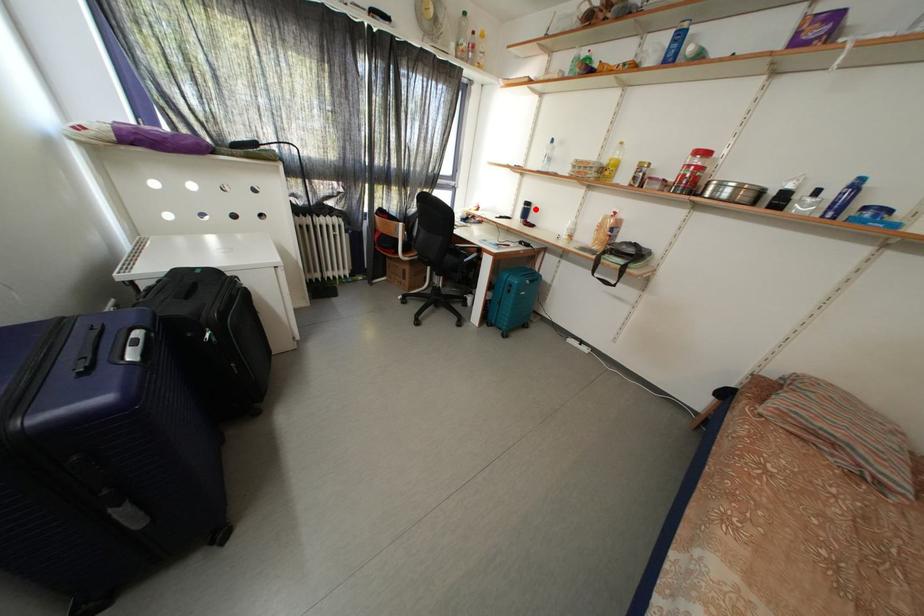
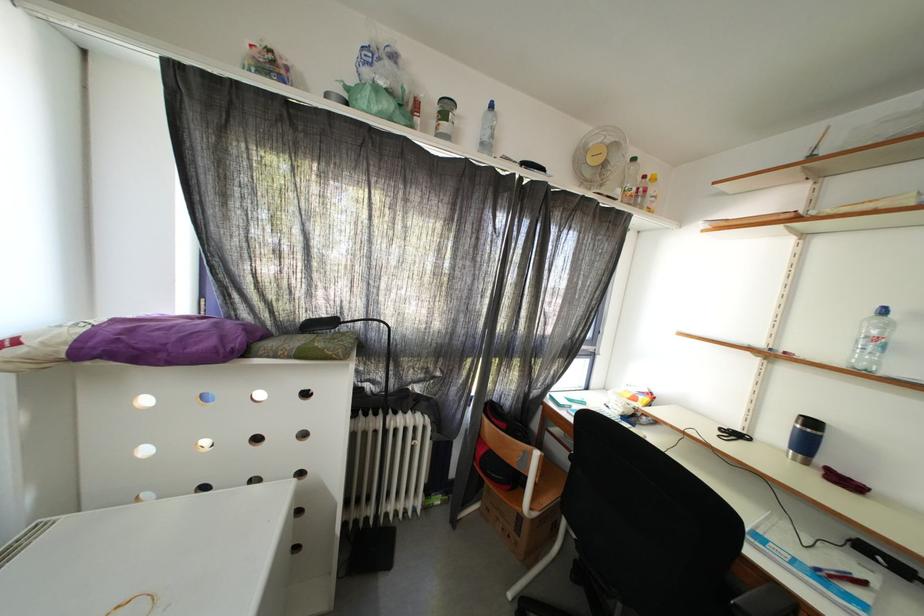
Locate, in the second image, the point that corresponds to the highlighted location in the first image.

(820, 429)